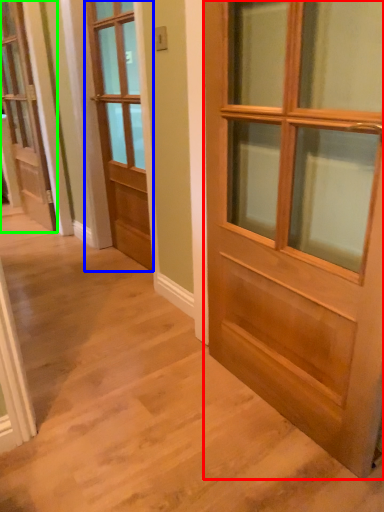
Question: Which is farther away from door (highlighted by a red box)? door (highlighted by a blue box) or door (highlighted by a green box)?

Choices:
 (A) door
 (B) door

Answer: (B)